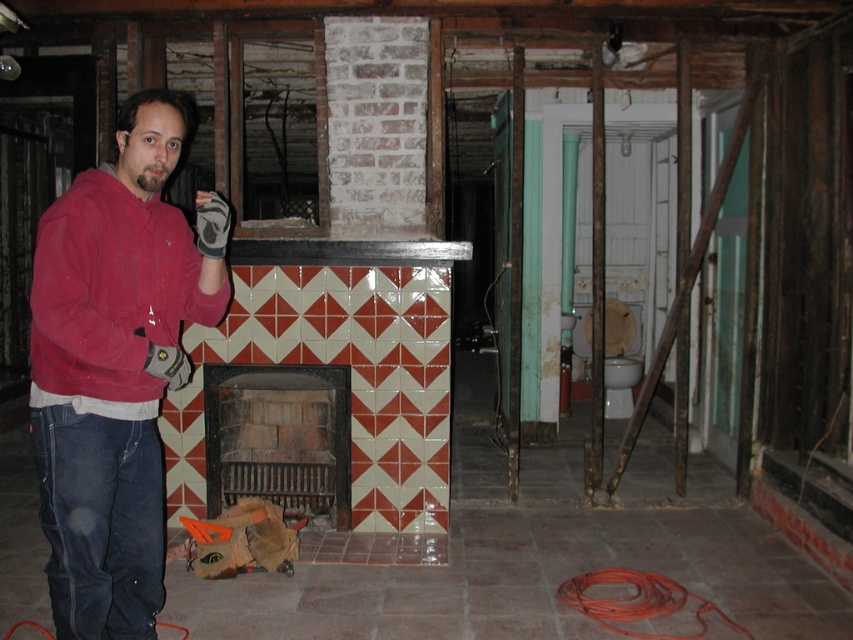
Question: Which point is closer to the camera?

Choices:
 (A) matte red hoodie at left
 (B) red brick fireplace at center

Answer: (A)

Question: Is matte red hoodie at left in front of red brick fireplace at center?

Choices:
 (A) yes
 (B) no

Answer: (A)

Question: Can you confirm if matte red hoodie at left is positioned above red brick fireplace at center?

Choices:
 (A) yes
 (B) no

Answer: (A)

Question: Which object appears farthest from the camera in this image?

Choices:
 (A) red brick fireplace at center
 (B) matte red hoodie at left

Answer: (A)

Question: Can you confirm if matte red hoodie at left is positioned below red brick fireplace at center?

Choices:
 (A) yes
 (B) no

Answer: (B)